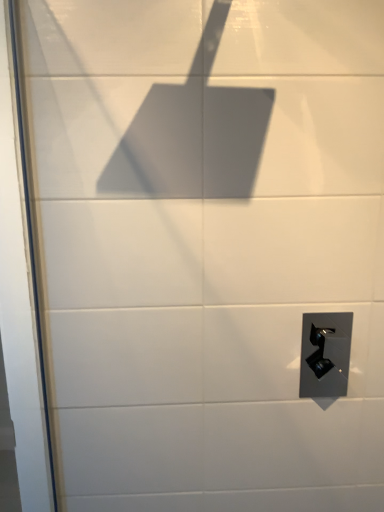
Question: Should I look upward or downward to see satin black door handle at lower right?

Choices:
 (A) down
 (B) up

Answer: (A)

Question: Does satin black door handle at lower right have a greater height compared to transparent glass screen door at left?

Choices:
 (A) no
 (B) yes

Answer: (A)

Question: Would you say satin black door handle at lower right is a long distance from transparent glass screen door at left?

Choices:
 (A) yes
 (B) no

Answer: (B)

Question: Is satin black door handle at lower right wider than transparent glass screen door at left?

Choices:
 (A) no
 (B) yes

Answer: (A)

Question: Does satin black door handle at lower right have a smaller size compared to transparent glass screen door at left?

Choices:
 (A) no
 (B) yes

Answer: (B)

Question: Does satin black door handle at lower right have a larger size compared to transparent glass screen door at left?

Choices:
 (A) yes
 (B) no

Answer: (B)

Question: Is satin black door handle at lower right to the left of transparent glass screen door at left from the viewer's perspective?

Choices:
 (A) yes
 (B) no

Answer: (B)

Question: Is transparent glass screen door at left smaller than satin black door handle at lower right?

Choices:
 (A) yes
 (B) no

Answer: (B)

Question: Is transparent glass screen door at left positioned behind satin black door handle at lower right?

Choices:
 (A) yes
 (B) no

Answer: (B)

Question: From the image's perspective, does transparent glass screen door at left appear higher than satin black door handle at lower right?

Choices:
 (A) yes
 (B) no

Answer: (A)

Question: Is transparent glass screen door at left outside satin black door handle at lower right?

Choices:
 (A) yes
 (B) no

Answer: (A)

Question: Is there a large distance between transparent glass screen door at left and satin black door handle at lower right?

Choices:
 (A) no
 (B) yes

Answer: (A)

Question: Is transparent glass screen door at left directly adjacent to satin black door handle at lower right?

Choices:
 (A) no
 (B) yes

Answer: (A)

Question: Considering the positions of satin black door handle at lower right and transparent glass screen door at left in the image, is satin black door handle at lower right bigger or smaller than transparent glass screen door at left?

Choices:
 (A) big
 (B) small

Answer: (B)